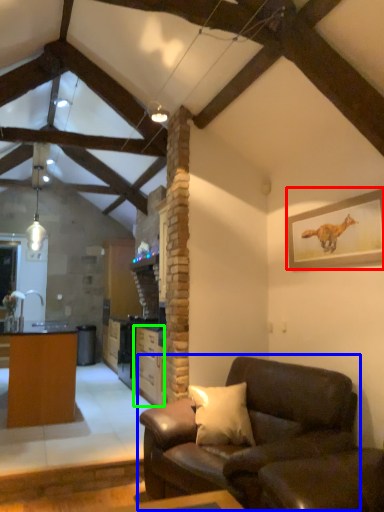
Question: Which object is positioned farthest from picture frame (highlighted by a red box)? Select from studio couch (highlighted by a blue box) and cabinetry (highlighted by a green box).

Choices:
 (A) studio couch
 (B) cabinetry

Answer: (B)